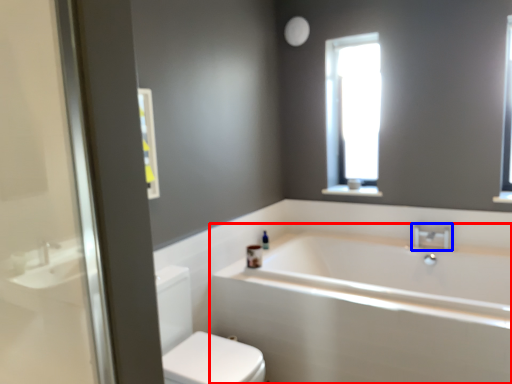
Question: Which point is further to the camera, bathtub (highlighted by a red box) or tap (highlighted by a blue box)?

Choices:
 (A) bathtub
 (B) tap

Answer: (B)